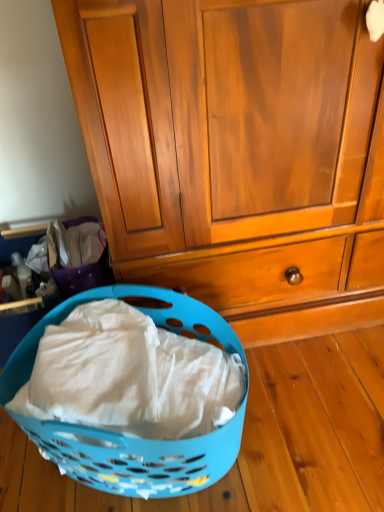
Question: From a real-world perspective, is wooden cabinet at center on blue plastic laundry basket at lower left?

Choices:
 (A) yes
 (B) no

Answer: (A)

Question: Can we say wooden cabinet at center lies outside blue plastic laundry basket at lower left?

Choices:
 (A) yes
 (B) no

Answer: (A)

Question: From a real-world perspective, is wooden cabinet at center located beneath blue plastic laundry basket at lower left?

Choices:
 (A) no
 (B) yes

Answer: (A)

Question: Is wooden cabinet at center to the left of blue plastic laundry basket at lower left from the viewer's perspective?

Choices:
 (A) yes
 (B) no

Answer: (B)

Question: Is wooden cabinet at center turned away from blue plastic laundry basket at lower left?

Choices:
 (A) yes
 (B) no

Answer: (B)

Question: Is wooden cabinet at center taller than blue plastic laundry basket at lower left?

Choices:
 (A) no
 (B) yes

Answer: (B)

Question: Is blue plastic laundry basket at lower left oriented towards wooden cabinet at center?

Choices:
 (A) no
 (B) yes

Answer: (A)

Question: Would you say blue plastic laundry basket at lower left is outside wooden cabinet at center?

Choices:
 (A) yes
 (B) no

Answer: (A)

Question: Is blue plastic laundry basket at lower left positioned behind wooden cabinet at center?

Choices:
 (A) no
 (B) yes

Answer: (A)

Question: From the image's perspective, would you say blue plastic laundry basket at lower left is shown under wooden cabinet at center?

Choices:
 (A) no
 (B) yes

Answer: (B)

Question: Does blue plastic laundry basket at lower left have a larger size compared to wooden cabinet at center?

Choices:
 (A) no
 (B) yes

Answer: (A)

Question: Does blue plastic laundry basket at lower left lie in front of wooden cabinet at center?

Choices:
 (A) no
 (B) yes

Answer: (B)

Question: From their relative heights in the image, would you say blue plastic laundry basket at lower left is taller or shorter than wooden cabinet at center?

Choices:
 (A) tall
 (B) short

Answer: (B)